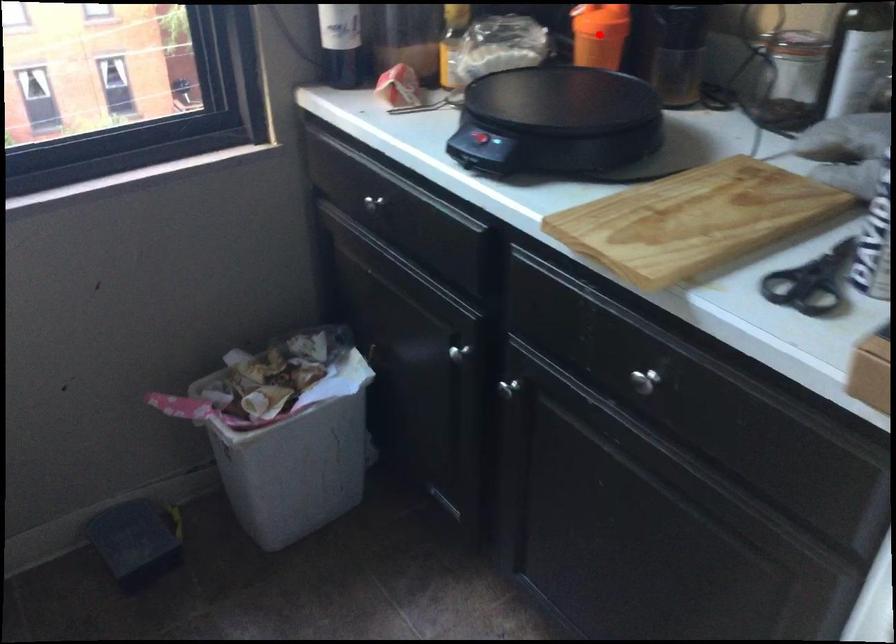
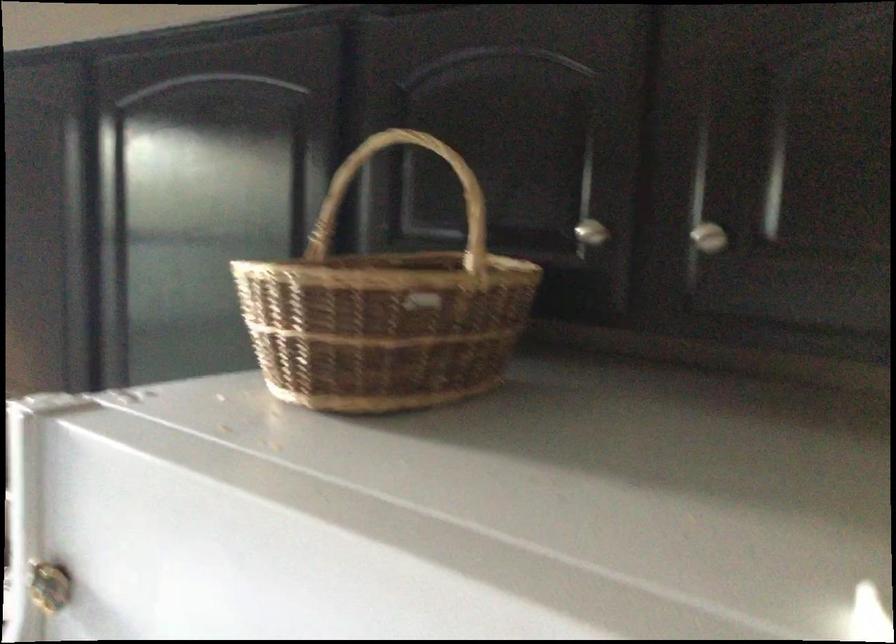
Question: I am providing you with two images of the same scene from different viewpoints. A red point is marked on the first image. Is the red point's position out of view in image 2?

Choices:
 (A) Yes
 (B) No

Answer: (A)